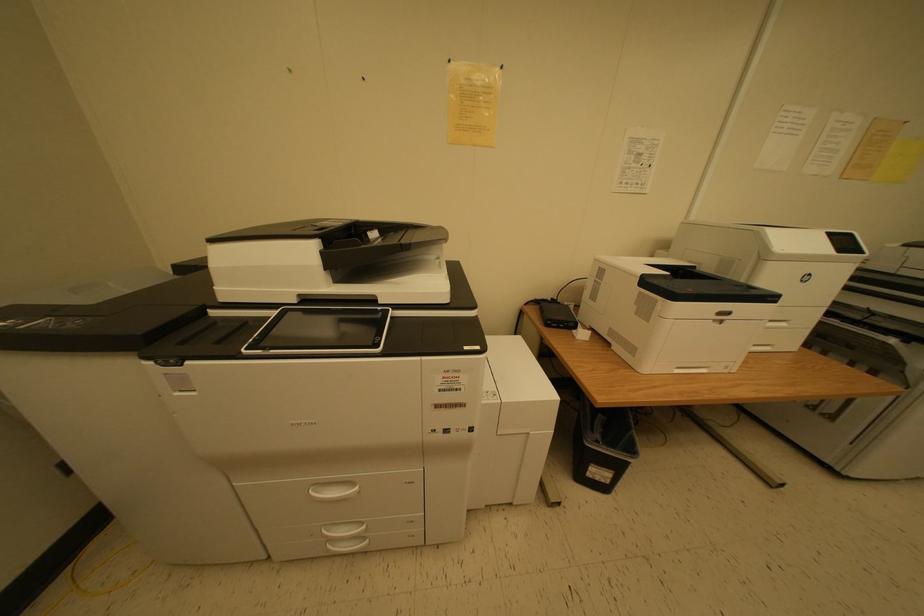
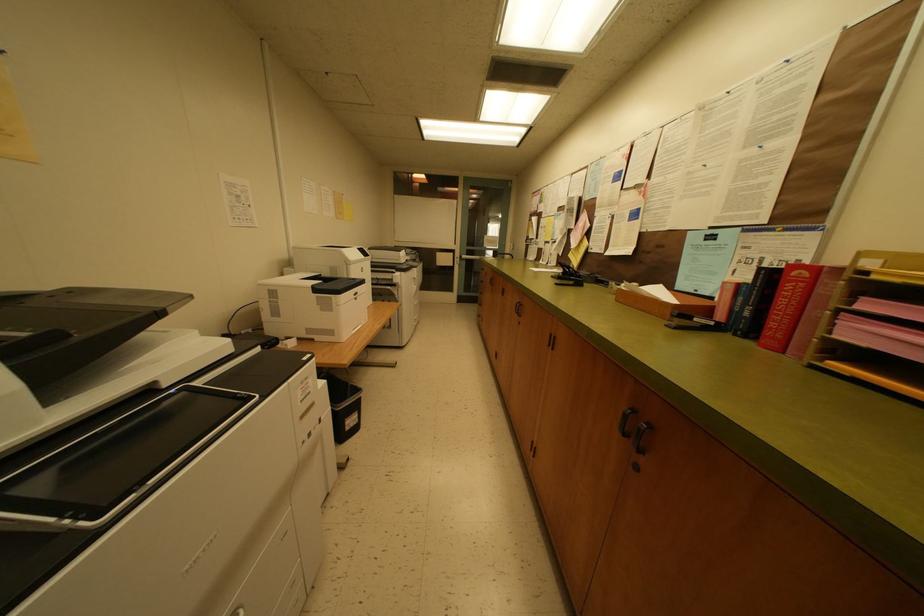
Consider the image. How did the camera likely rotate?

The rotation direction of the camera is right-down.